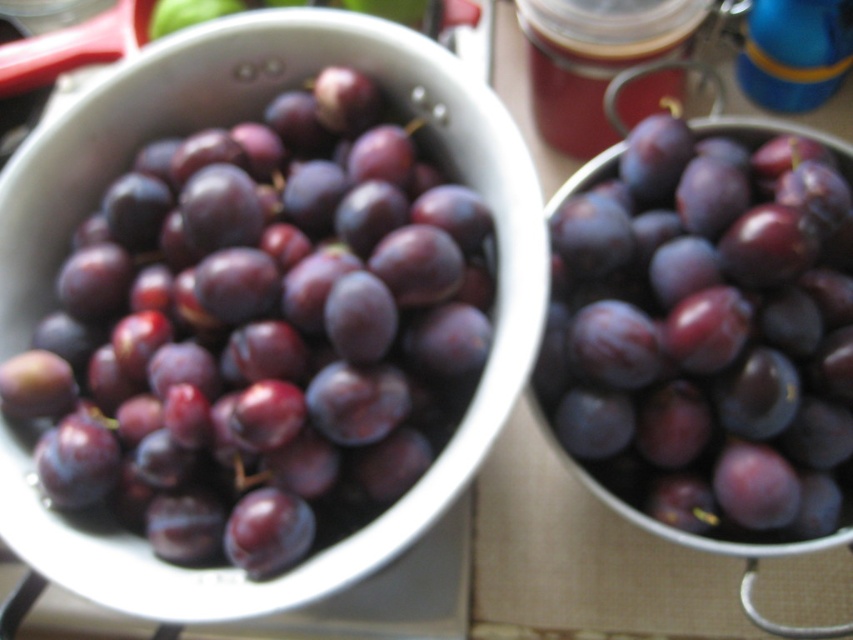
You are arranging fruits on a kitchen counter and have two shiny purple grapes at left and shiny purple grapes at center. Which group of grapes is taller?

The shiny purple grapes at left are taller than the shiny purple grapes at center.

You are standing in front of a kitchen counter with two colanders of plums. There are two points marked on the counter. The first point is at coordinates point (381, 324) and the second is at point (825, 182). If you want to place a small bowl between these two points so that it is closer to the point that is in front, where should you place the bowl?

The point at (381, 324) is in front of the point at (825, 182). Therefore, to place the bowl closer to the front point, you should position it nearer to point (381, 324).

You are arranging fruits on a kitchen counter and have two shiny purple grapes at left and shiny purple grapes at center. Which group of grapes is wider?

The shiny purple grapes at left are wider than the shiny purple grapes at center.